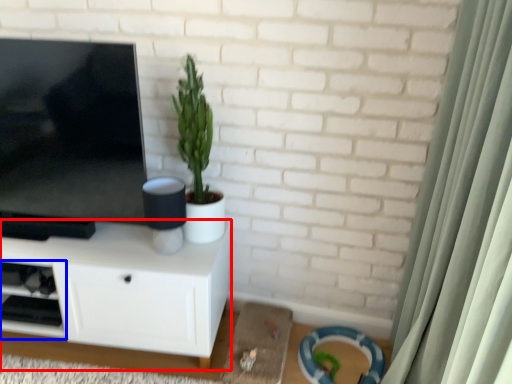
Question: Which object appears farthest to the camera in this image, cabinetry (highlighted by a red box) or shelf (highlighted by a blue box)?

Choices:
 (A) cabinetry
 (B) shelf

Answer: (B)